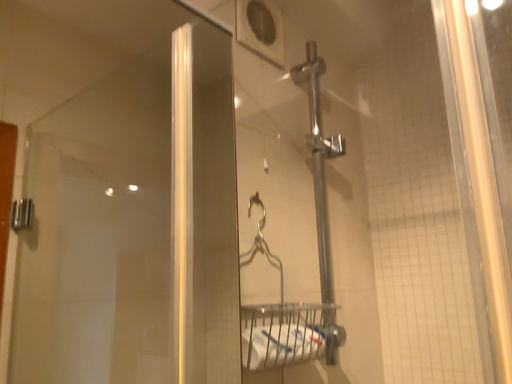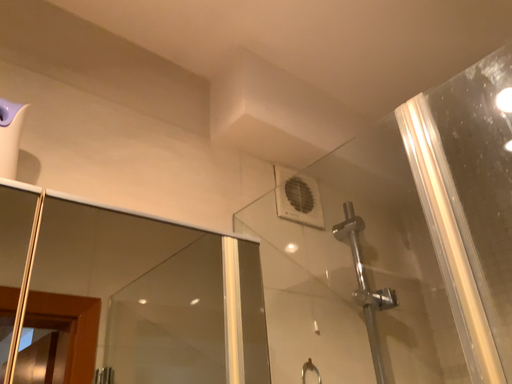
Question: How did the camera likely rotate when shooting the video?

Choices:
 (A) rotated left
 (B) rotated right

Answer: (A)